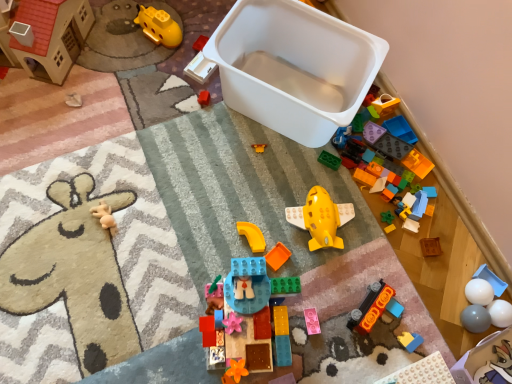
The width and height of the screenshot is (512, 384). I want to click on vacant space that's between yellow plastic submarine at upper left, which appears as the third toy when viewed from the left, and beige rubber bear at left, placed as the 2th toy when sorted from left to right, so [x=136, y=116].